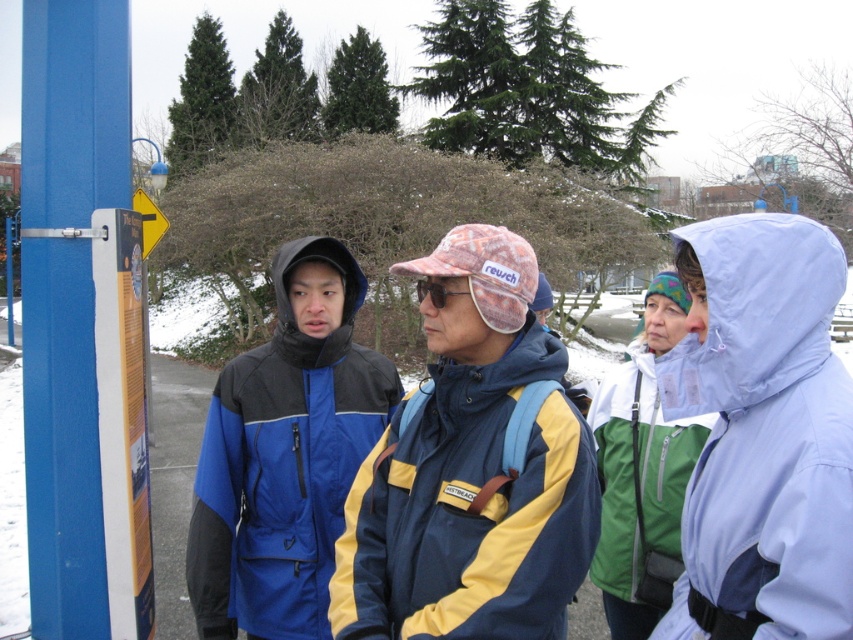
Question: Is blue/yellow nylon jacket at center to the left of pink fabric goggles at center from the viewer's perspective?

Choices:
 (A) no
 (B) yes

Answer: (A)

Question: Does blue painted metal signpost at left appear over blue/yellow fabric jacket at center?

Choices:
 (A) yes
 (B) no

Answer: (A)

Question: Does blue painted metal signpost at left have a smaller size compared to green matte jacket at center?

Choices:
 (A) no
 (B) yes

Answer: (B)

Question: Which point appears closest to the camera in this image?

Choices:
 (A) (109, 525)
 (B) (666, 480)

Answer: (A)

Question: Which is nearer to the blue/yellow fabric jacket at center?

Choices:
 (A) light blue waterproof jacket at right
 (B) blue/yellow nylon jacket at center
 (C) pink fabric goggles at center

Answer: (C)

Question: Which of the following is the farthest from the observer?

Choices:
 (A) (718, 467)
 (B) (374, 433)
 (C) (422, 280)

Answer: (B)